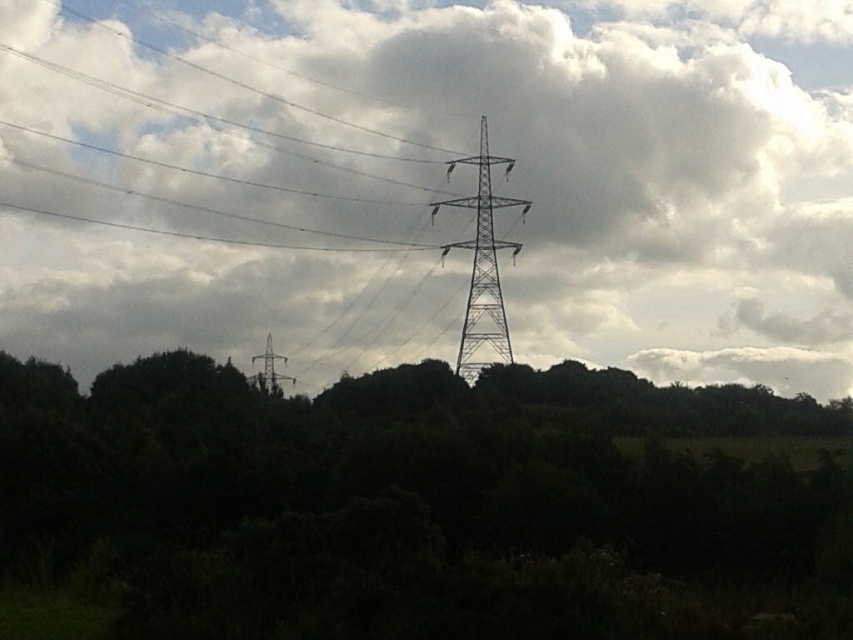
In the scene shown: You are a bird flying over the landscape. You see the dark green foliage at center and the metallic gray tower at center. Which object is positioned to the right of the other?

The dark green foliage at center is to the right of the metallic gray tower at center.

You are a maintenance worker who needs to inspect both the metallic silver tower at center and the metallic gray tower at center. Based on their widths, which tower will require a wider safety perimeter during inspection to ensure safety?

The metallic gray tower at center has a greater width than the metallic silver tower at center, so it will require a wider safety perimeter during inspection to ensure safety.